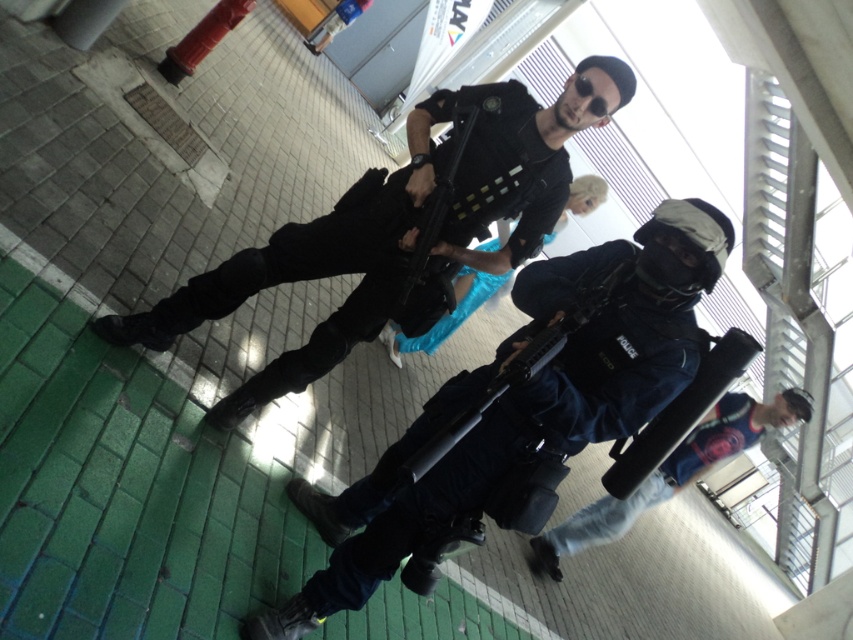
Does matte black uniform at center have a smaller size compared to blue fabric bag at lower right?

Actually, matte black uniform at center might be larger than blue fabric bag at lower right.

Does matte black uniform at center have a greater height compared to blue fabric bag at lower right?

Yes.

In order to click on matte black uniform at center in this screenshot , I will do `click(401, 228)`.

Who is shorter, dark blue uniform at center or matte black uniform at center?

A: Standing shorter between the two is matte black uniform at center.

Where is `dark blue uniform at center`? The width and height of the screenshot is (853, 640). dark blue uniform at center is located at coordinates (521, 404).

The height and width of the screenshot is (640, 853). What are the coordinates of `dark blue uniform at center` in the screenshot? It's located at (521, 404).

Locate an element on the screen. The width and height of the screenshot is (853, 640). dark blue uniform at center is located at coordinates (521, 404).

Between point (511, 449) and point (563, 532), which one is positioned behind?

Point (563, 532)

Where is `dark blue uniform at center`? The width and height of the screenshot is (853, 640). dark blue uniform at center is located at coordinates (521, 404).